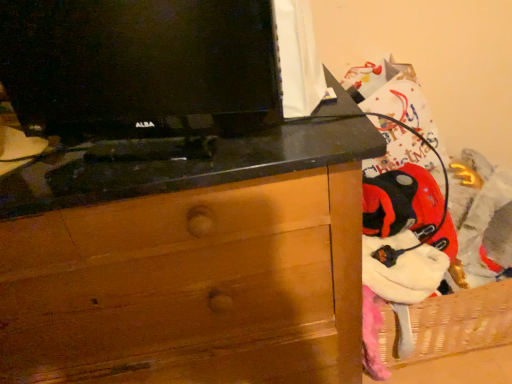
Question: From a real-world perspective, is black glossy tv at upper left physically located above or below wooden chest of drawers at center?

Choices:
 (A) below
 (B) above

Answer: (B)

Question: Is black glossy tv at upper left in front of or behind wooden chest of drawers at center in the image?

Choices:
 (A) front
 (B) behind

Answer: (A)

Question: Looking at the image, does black glossy tv at upper left seem bigger or smaller compared to wooden chest of drawers at center?

Choices:
 (A) big
 (B) small

Answer: (B)

Question: Is point (121, 301) positioned closer to the camera than point (103, 109)?

Choices:
 (A) closer
 (B) farther

Answer: (B)

Question: Considering their positions, is wooden chest of drawers at center located in front of or behind black glossy tv at upper left?

Choices:
 (A) behind
 (B) front

Answer: (A)

Question: From the image's perspective, relative to black glossy tv at upper left, is wooden chest of drawers at center above or below?

Choices:
 (A) above
 (B) below

Answer: (B)

Question: From a real-world perspective, is wooden chest of drawers at center physically located above or below black glossy tv at upper left?

Choices:
 (A) above
 (B) below

Answer: (B)